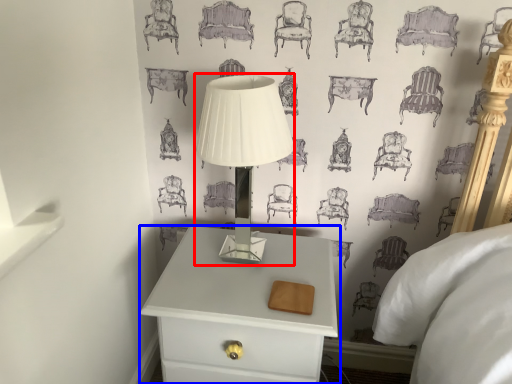
Question: Which object is further to the camera taking this photo, table lamp (highlighted by a red box) or nightstand (highlighted by a blue box)?

Choices:
 (A) table lamp
 (B) nightstand

Answer: (B)